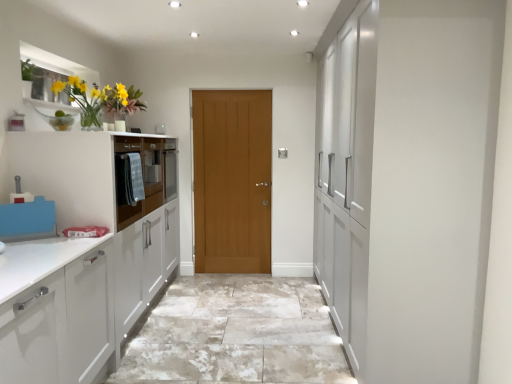
In order to click on free space in front of light brown wooden door at center in this screenshot , I will do `click(229, 287)`.